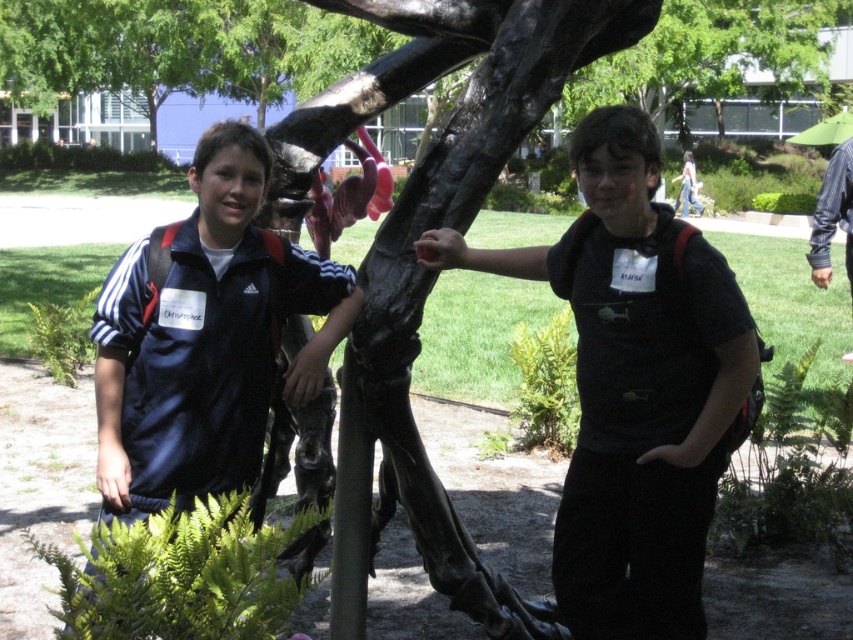
Based on the photo, is dark blue fabric jacket at left below green matte tree at upper center?

Indeed, dark blue fabric jacket at left is positioned under green matte tree at upper center.

Is dark blue fabric jacket at left above green matte tree at upper center?

Incorrect, dark blue fabric jacket at left is not positioned above green matte tree at upper center.

Does point (132, 259) lie in front of point (721, 83)?

Yes.

Find the location of `dark blue fabric jacket at left`. dark blue fabric jacket at left is located at coordinates (206, 358).

Who is more forward, (577, 532) or (828, 192)?

Point (577, 532)

Which is behind, point (602, 392) or point (811, 234)?

Positioned behind is point (811, 234).

Is point (720, 328) closer to viewer compared to point (817, 212)?

Yes.

What are the coordinates of `matte black backpack at center` in the screenshot? It's located at (634, 385).

Is green matte tree at upper center to the right of blue striped shirt at upper right from the viewer's perspective?

Correct, you'll find green matte tree at upper center to the right of blue striped shirt at upper right.

Between green matte tree at upper center and blue striped shirt at upper right, which one has more height?

green matte tree at upper center is taller.

Measure the distance between green matte tree at upper center and camera.

The distance of green matte tree at upper center from camera is 3.74 meters.

Where is `green matte tree at upper center`? green matte tree at upper center is located at coordinates (711, 54).